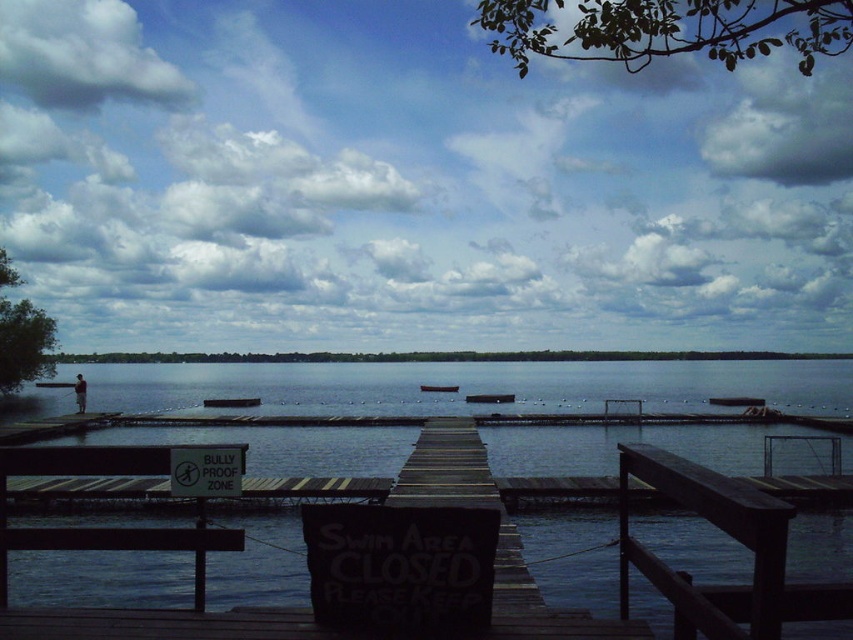
You are a park ranger checking the lake area. You notice the white plastic sign at center and the dark gray wooden dock at center. Which object is bigger?

The white plastic sign at center is larger in size than the dark gray wooden dock at center.

You are a visitor at the lakeside and want to find the white plastic sign at center. According to the scene, where should you look relative to the dark wood dock at center?

The dark wood dock at center is below the white plastic sign at center, so you should look above the dark wood dock at center to find the white plastic sign at center.